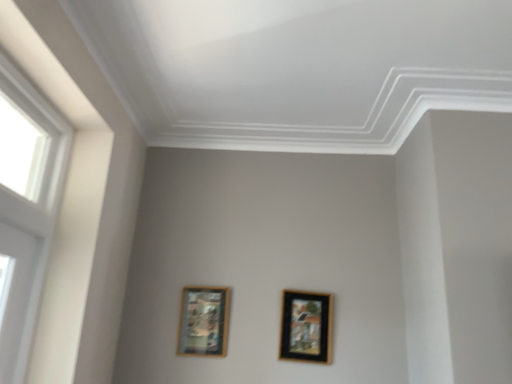
Question: Can you confirm if black glossy picture frame at center, marked as the 1th picture frame in a right-to-left arrangement, is positioned to the left of white plastic window at left?

Choices:
 (A) no
 (B) yes

Answer: (A)

Question: From a real-world perspective, is black glossy picture frame at center, which appears as the second picture frame when viewed from the left, located higher than white plastic window at left?

Choices:
 (A) yes
 (B) no

Answer: (B)

Question: From the image's perspective, is black glossy picture frame at center, marked as the 1th picture frame in a right-to-left arrangement, on white plastic window at left?

Choices:
 (A) no
 (B) yes

Answer: (A)

Question: From the image's perspective, is black glossy picture frame at center, marked as the 1th picture frame in a right-to-left arrangement, below white plastic window at left?

Choices:
 (A) yes
 (B) no

Answer: (A)

Question: Considering the relative sizes of black glossy picture frame at center, which appears as the second picture frame when viewed from the left, and white plastic window at left in the image provided, is black glossy picture frame at center, which appears as the second picture frame when viewed from the left, taller than white plastic window at left?

Choices:
 (A) yes
 (B) no

Answer: (B)

Question: In terms of height, does black glossy picture frame at center, marked as the 1th picture frame in a right-to-left arrangement, look taller or shorter compared to white plastic window at left?

Choices:
 (A) tall
 (B) short

Answer: (B)

Question: Is black glossy picture frame at center, marked as the 1th picture frame in a right-to-left arrangement, wider or thinner than white plastic window at left?

Choices:
 (A) wide
 (B) thin

Answer: (B)

Question: Does point (287, 292) appear closer or farther from the camera than point (68, 150)?

Choices:
 (A) closer
 (B) farther

Answer: (B)

Question: Relative to white plastic window at left, is black glossy picture frame at center, marked as the 1th picture frame in a right-to-left arrangement, in front or behind?

Choices:
 (A) behind
 (B) front

Answer: (A)

Question: Is white plastic window at left taller or shorter than wooden framed artwork at lower left, positioned as the 2th picture frame in right-to-left order?

Choices:
 (A) short
 (B) tall

Answer: (B)

Question: Is white plastic window at left in front of or behind wooden framed artwork at lower left, which is counted as the 1th picture frame, starting from the left, in the image?

Choices:
 (A) front
 (B) behind

Answer: (A)

Question: From the image's perspective, is white plastic window at left located above or below wooden framed artwork at lower left, positioned as the 2th picture frame in right-to-left order?

Choices:
 (A) above
 (B) below

Answer: (A)

Question: Considering the positions of white plastic window at left and wooden framed artwork at lower left, which is counted as the 1th picture frame, starting from the left, in the image, is white plastic window at left bigger or smaller than wooden framed artwork at lower left, which is counted as the 1th picture frame, starting from the left,?

Choices:
 (A) small
 (B) big

Answer: (B)

Question: In the image, is wooden framed artwork at lower left, positioned as the 2th picture frame in right-to-left order, positioned in front of or behind black glossy picture frame at center, marked as the 1th picture frame in a right-to-left arrangement?

Choices:
 (A) behind
 (B) front

Answer: (A)

Question: From a real-world perspective, is wooden framed artwork at lower left, positioned as the 2th picture frame in right-to-left order, above or below black glossy picture frame at center, marked as the 1th picture frame in a right-to-left arrangement?

Choices:
 (A) below
 (B) above

Answer: (A)